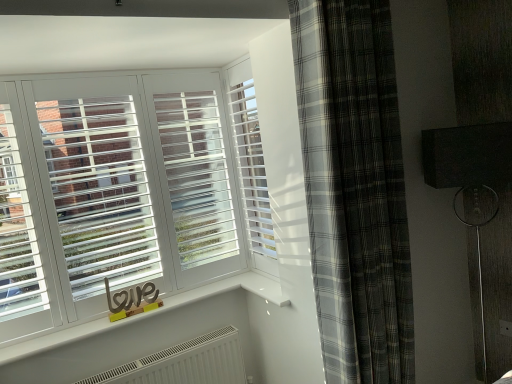
The image size is (512, 384). Describe the element at coordinates (251, 166) in the screenshot. I see `white plastic blinds at center` at that location.

Locate an element on the screen. white plastic blinds at center is located at coordinates (251, 166).

The image size is (512, 384). Describe the element at coordinates (354, 189) in the screenshot. I see `gray plaid curtain at right` at that location.

Identify the location of gray plaid curtain at right. (354, 189).

Image resolution: width=512 pixels, height=384 pixels. Identify the location of white plastic blinds at center. (251, 166).

Is gray plaid curtain at right to the left or to the right of white plastic blinds at center in the image?

From the image, it's evident that gray plaid curtain at right is to the right of white plastic blinds at center.

Is gray plaid curtain at right closer to the viewer compared to white plastic blinds at center?

Yes, it is.

Considering the positions of point (350, 369) and point (250, 176), is point (350, 369) closer or farther from the camera than point (250, 176)?

Clearly, point (350, 369) is closer to the camera than point (250, 176).

From the image's perspective, is gray plaid curtain at right located above white plastic blinds at center?

No, from the image's perspective, gray plaid curtain at right is not over white plastic blinds at center.

From a real-world perspective, is gray plaid curtain at right above or below white plastic blinds at center?

Clearly, from a real-world perspective, gray plaid curtain at right is below white plastic blinds at center.

Based on the photo, considering the sizes of objects gray plaid curtain at right and white plastic blinds at center in the image provided, who is thinner, gray plaid curtain at right or white plastic blinds at center?

Thinner between the two is white plastic blinds at center.

From their relative heights in the image, would you say gray plaid curtain at right is taller or shorter than white plastic blinds at center?

gray plaid curtain at right is taller than white plastic blinds at center.

Can you confirm if gray plaid curtain at right is smaller than white plastic blinds at center?

No, gray plaid curtain at right is not smaller than white plastic blinds at center.

Is gray plaid curtain at right completely or partially outside of white plastic blinds at center?

gray plaid curtain at right lies outside white plastic blinds at center's area.

Is gray plaid curtain at right next to white plastic blinds at center?

No, gray plaid curtain at right is not beside white plastic blinds at center.

Is gray plaid curtain at right turned away from white plastic blinds at center?

Yes.

Can you tell me how much gray plaid curtain at right and white plastic blinds at center differ in facing direction?

The angular difference between gray plaid curtain at right and white plastic blinds at center is 87.5 degrees.

I want to click on window located above the gray plaid curtain at right (from the image's perspective), so click(251, 166).

Between white plastic blinds at center and gray plaid curtain at right, which one appears on the right side from the viewer's perspective?

From the viewer's perspective, gray plaid curtain at right appears more on the right side.

Does white plastic blinds at center lie behind gray plaid curtain at right?

Yes, it is behind gray plaid curtain at right.

Considering the positions of point (259, 125) and point (321, 286), is point (259, 125) closer or farther from the camera than point (321, 286)?

Point (259, 125).

From the image's perspective, which is below, white plastic blinds at center or gray plaid curtain at right?

gray plaid curtain at right is shown below in the image.

From a real-world perspective, does white plastic blinds at center stand above gray plaid curtain at right?

Yes, from a real-world perspective, white plastic blinds at center is on top of gray plaid curtain at right.

Considering the sizes of objects white plastic blinds at center and gray plaid curtain at right in the image provided, who is thinner, white plastic blinds at center or gray plaid curtain at right?

Thinner between the two is white plastic blinds at center.

Considering the relative sizes of white plastic blinds at center and gray plaid curtain at right in the image provided, is white plastic blinds at center shorter than gray plaid curtain at right?

Yes, white plastic blinds at center is shorter than gray plaid curtain at right.

Looking at the image, does white plastic blinds at center seem bigger or smaller compared to gray plaid curtain at right?

white plastic blinds at center is smaller than gray plaid curtain at right.

Would you say white plastic blinds at center is outside gray plaid curtain at right?

Absolutely, white plastic blinds at center is external to gray plaid curtain at right.

Is white plastic blinds at center next to gray plaid curtain at right and touching it?

white plastic blinds at center and gray plaid curtain at right are clearly separated.

Is white plastic blinds at center facing towards gray plaid curtain at right?

No, white plastic blinds at center is not turned towards gray plaid curtain at right.

How many degrees apart are the facing directions of white plastic blinds at center and gray plaid curtain at right?

87.5 degrees.

You are a GUI agent. You are given a task and a screenshot of the screen. Output one action in this format:
    pyautogui.click(x=<x>, y=<y>)
    Task: Click on the window above the gray plaid curtain at right (from a real-world perspective)
    
    Given the screenshot: What is the action you would take?
    pyautogui.click(x=251, y=166)

What are the coordinates of `curtain that is under the white plastic blinds at center (from a real-world perspective)` in the screenshot? It's located at (354, 189).

The height and width of the screenshot is (384, 512). Find the location of `window above the gray plaid curtain at right (from a real-world perspective)`. window above the gray plaid curtain at right (from a real-world perspective) is located at coordinates (251, 166).